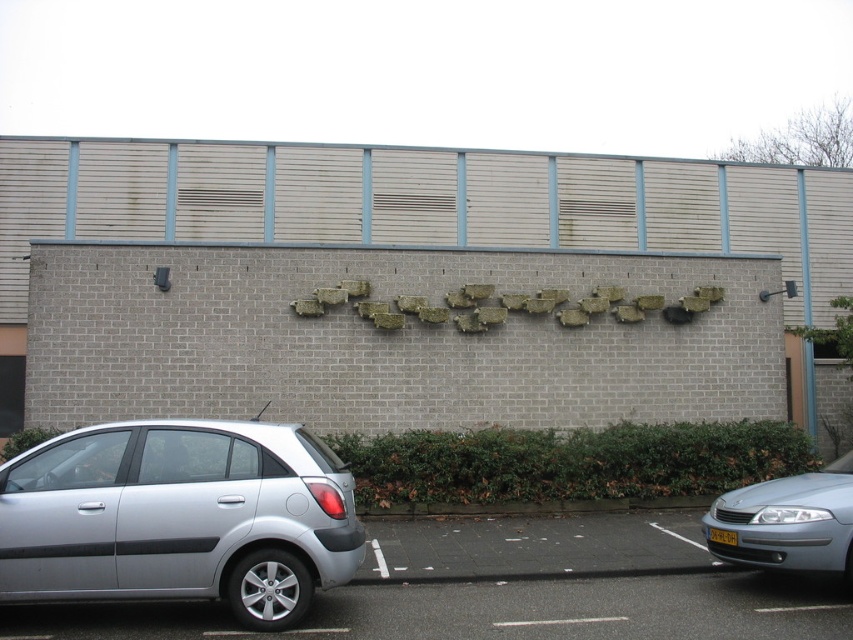
Question: Is silver metallic hatchback at lower left bigger than silver metallic car at lower left?

Choices:
 (A) yes
 (B) no

Answer: (A)

Question: From the image, what is the correct spatial relationship of silver metallic hatchback at lower left in relation to silver metallic car at lower left?

Choices:
 (A) left
 (B) right

Answer: (A)

Question: Which point is closer to the camera taking this photo?

Choices:
 (A) (756, 484)
 (B) (36, 445)
 (C) (393, 568)

Answer: (B)

Question: Which point appears closest to the camera in this image?

Choices:
 (A) (659, 534)
 (B) (91, 547)
 (C) (721, 513)

Answer: (B)

Question: Considering the relative positions of silver metallic hatchback at lower left and silver metallic car at lower left in the image provided, where is silver metallic hatchback at lower left located with respect to silver metallic car at lower left?

Choices:
 (A) above
 (B) below

Answer: (A)

Question: Which point is closer to the camera?

Choices:
 (A) silver metallic hatchback at lower left
 (B) matte silver sedan at lower right
 (C) silver metallic car at lower left

Answer: (A)